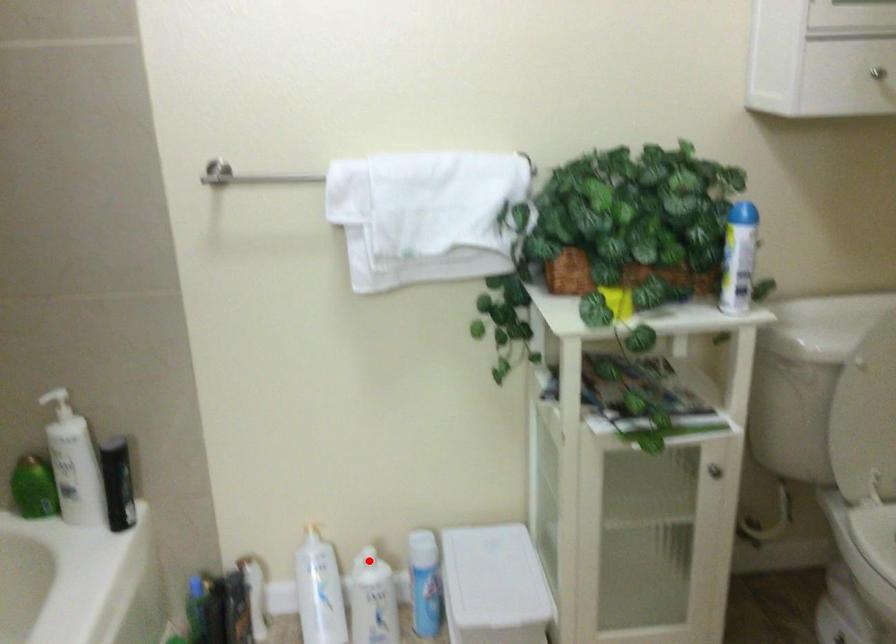
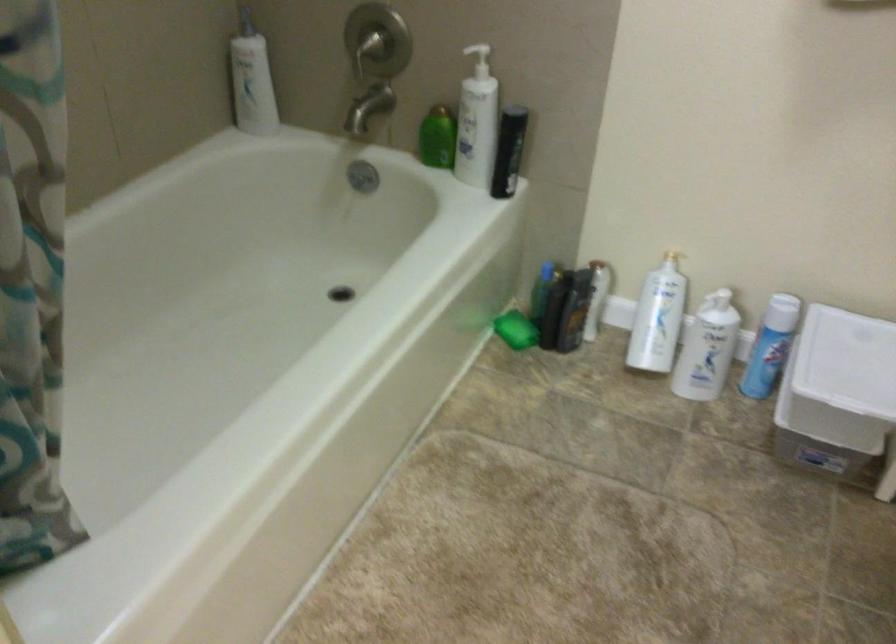
Where in the second image is the point corresponding to the highlighted location from the first image?

(719, 301)